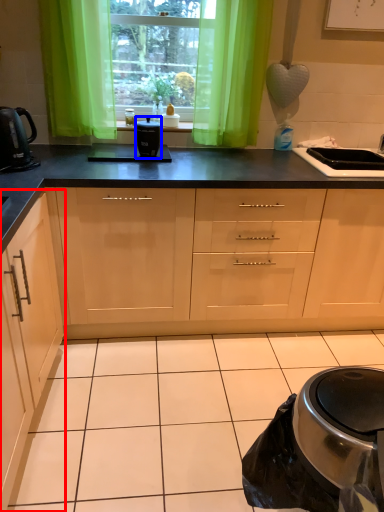
Question: Which object appears farthest to the camera in this image, cabinetry (highlighted by a red box) or kitchen appliance (highlighted by a blue box)?

Choices:
 (A) cabinetry
 (B) kitchen appliance

Answer: (B)